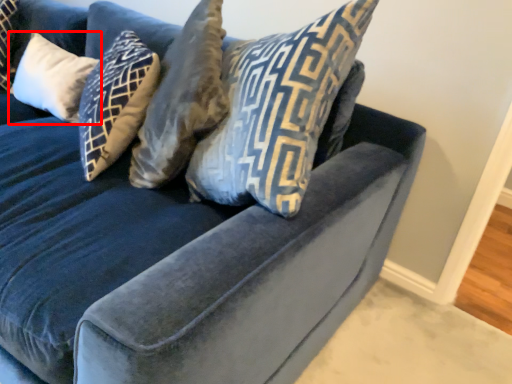
Question: From the image, what is the correct spatial relationship of pillow (annotated by the red box) in relation to pillow?

Choices:
 (A) right
 (B) left

Answer: (B)